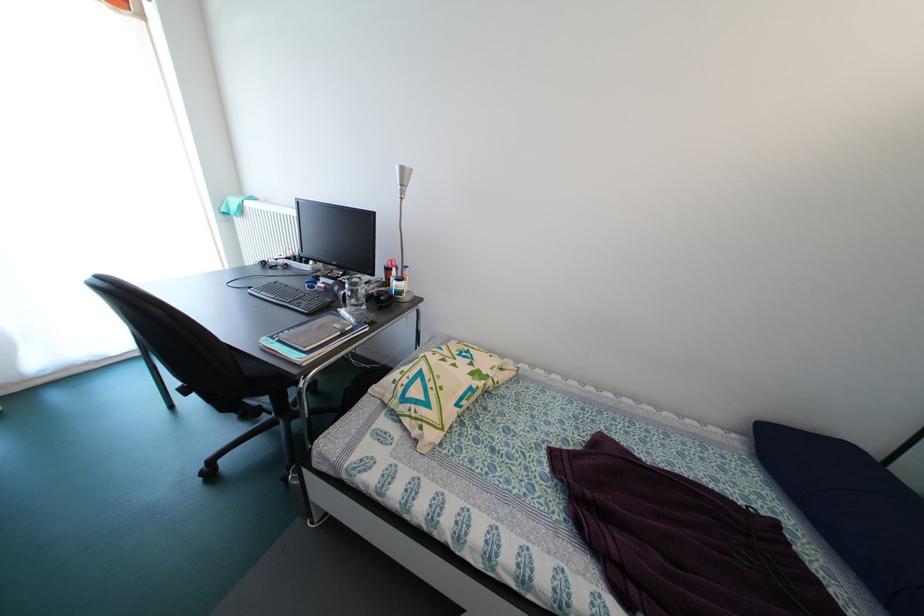
The image size is (924, 616). What are the coordinates of `silver desk lamp` in the screenshot? It's located at (402, 233).